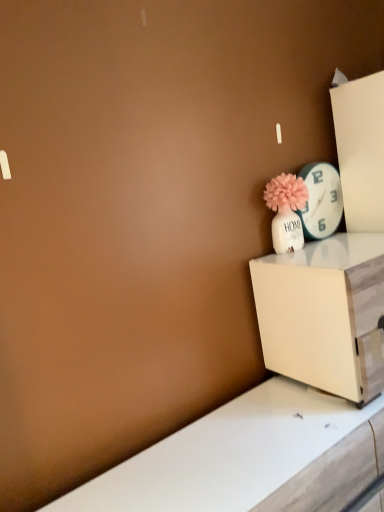
Question: Based on their positions, is matte white vase with pink flower at upper right located to the left or right of white wood nightstand at lower right?

Choices:
 (A) left
 (B) right

Answer: (A)

Question: Is matte white vase with pink flower at upper right inside or outside of white wood nightstand at lower right?

Choices:
 (A) inside
 (B) outside

Answer: (B)

Question: Which object is the farthest from the white glossy clock at upper right?

Choices:
 (A) white wood nightstand at lower right
 (B) matte white vase with pink flower at upper right

Answer: (A)

Question: Which object is the farthest from the white glossy clock at upper right?

Choices:
 (A) white wood nightstand at lower right
 (B) matte white vase with pink flower at upper right

Answer: (A)